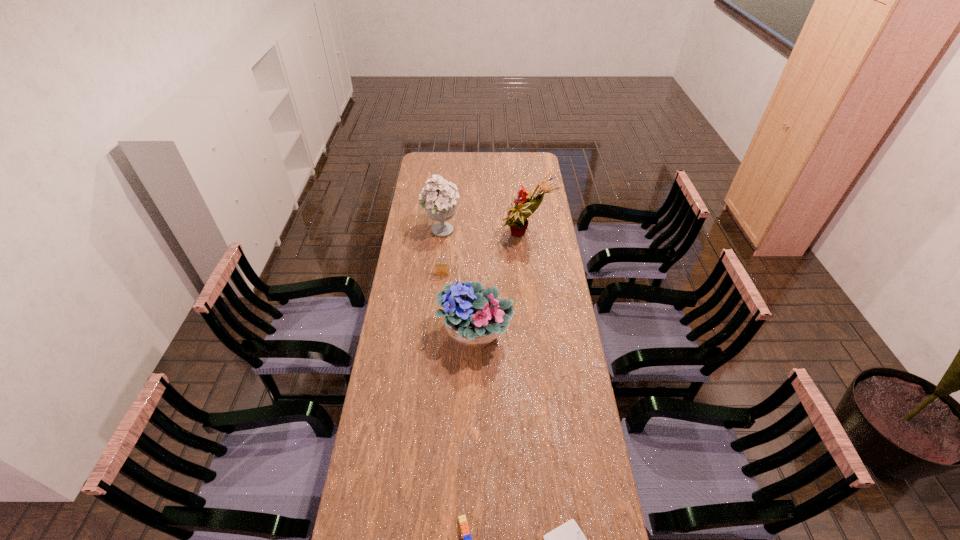
Locate an element on the screen. This screenshot has height=540, width=960. the fourth farthest object is located at coordinates (473, 319).

I want to click on the third tallest object, so click(x=473, y=319).

Locate an element on the screen. The width and height of the screenshot is (960, 540). the fourth tallest object is located at coordinates (441, 269).

Where is `padlock`? Image resolution: width=960 pixels, height=540 pixels. padlock is located at coordinates (441, 269).

Where is `free space located on the front of the fourth farthest object`? free space located on the front of the fourth farthest object is located at coordinates (474, 434).

Locate an element on the screen. Image resolution: width=960 pixels, height=540 pixels. free space located 0.220m on the front-facing side of the fourth tallest object is located at coordinates (x=440, y=313).

Locate an element on the screen. This screenshot has width=960, height=540. object located at the left edge is located at coordinates (440, 203).

Identify the location of object that is at the right edge. (516, 219).

Locate an element on the screen. blank area at the far edge is located at coordinates (481, 171).

You are a GUI agent. You are given a task and a screenshot of the screen. Output one action in this format:
    pyautogui.click(x=<x>, y=<y>)
    Task: Click on the vacant space at the left edge of the desktop
    
    Given the screenshot: What is the action you would take?
    pyautogui.click(x=394, y=442)